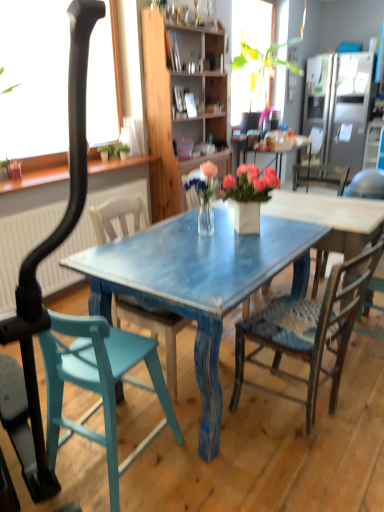
The image size is (384, 512). Describe the element at coordinates (306, 333) in the screenshot. I see `wooden chair with woven seat at center, which appears as the third chair when viewed from the left` at that location.

Measure the distance between wooden cabinet at center and camera.

wooden cabinet at center is 10.69 feet away from camera.

The image size is (384, 512). I want to click on satin silver refrigerator at upper right, so click(344, 110).

Is point (154, 196) less distant than point (370, 195)?

No, (154, 196) is behind (370, 195).

Is wooden cabinet at center far away from wooden chair at right, the 1th chair from the right?

Indeed, wooden cabinet at center is not near wooden chair at right, the 1th chair from the right.

From the image's perspective, does wooden cabinet at center appear lower than wooden chair at right, the 1th chair from the right?

Incorrect, from the image's perspective, wooden cabinet at center is higher than wooden chair at right, the 1th chair from the right.

Based on the photo, from a real-world perspective, which object stands above the other?

satin silver refrigerator at upper right.

Can you confirm if teal painted wood chair at lower left, positioned as the 4th chair in right-to-left order, is bigger than satin silver refrigerator at upper right?

No, teal painted wood chair at lower left, positioned as the 4th chair in right-to-left order, is not bigger than satin silver refrigerator at upper right.

Is teal painted wood chair at lower left, positioned as the 4th chair in right-to-left order, taller or shorter than satin silver refrigerator at upper right?

Considering their sizes, teal painted wood chair at lower left, positioned as the 4th chair in right-to-left order, has less height than satin silver refrigerator at upper right.

Between wooden chair at right, placed as the 4th chair when sorted from left to right, and satin silver refrigerator at upper right, which one is positioned behind?

Positioned behind is satin silver refrigerator at upper right.

Are wooden chair at right, placed as the 4th chair when sorted from left to right, and satin silver refrigerator at upper right located far from each other?

That's right, there is a large distance between wooden chair at right, placed as the 4th chair when sorted from left to right, and satin silver refrigerator at upper right.

Could you tell me if wooden chair at right, placed as the 4th chair when sorted from left to right, is turned towards satin silver refrigerator at upper right?

No, wooden chair at right, placed as the 4th chair when sorted from left to right, does not turn towards satin silver refrigerator at upper right.

Based on their sizes in the image, would you say wooden chair at right, the 1th chair from the right, is bigger or smaller than satin silver refrigerator at upper right?

Considering their sizes, wooden chair at right, the 1th chair from the right, takes up less space than satin silver refrigerator at upper right.

In the scene shown: Is wooden chair with woven seat at center, which appears as the third chair when viewed from the left, positioned with its back to wooden chair at right, the 1th chair from the right?

wooden chair with woven seat at center, which appears as the third chair when viewed from the left, does not have its back to wooden chair at right, the 1th chair from the right.

Based on the photo, between wooden chair with woven seat at center, which appears as the third chair when viewed from the left, and wooden chair at right, placed as the 4th chair when sorted from left to right, which one appears on the right side from the viewer's perspective?

From the viewer's perspective, wooden chair at right, placed as the 4th chair when sorted from left to right, appears more on the right side.

Is wooden chair with woven seat at center, arranged as the 2th chair when viewed from the right, next to wooden chair at right, placed as the 4th chair when sorted from left to right, and touching it?

No.

Is teal wood chair at center, which appears as the 3th chair when viewed from the right, positioned behind wooden chair with woven seat at center, arranged as the 2th chair when viewed from the right?

Yes, it is behind wooden chair with woven seat at center, arranged as the 2th chair when viewed from the right.

In the scene shown: Looking at the image, does teal wood chair at center, the 2th chair viewed from the left, seem bigger or smaller compared to wooden chair with woven seat at center, which appears as the third chair when viewed from the left?

Clearly, teal wood chair at center, the 2th chair viewed from the left, is larger in size than wooden chair with woven seat at center, which appears as the third chair when viewed from the left.

Is teal wood chair at center, the 2th chair viewed from the left, next to wooden chair with woven seat at center, which appears as the third chair when viewed from the left?

teal wood chair at center, the 2th chair viewed from the left, and wooden chair with woven seat at center, which appears as the third chair when viewed from the left, are not in contact.

Between teal wood chair at center, the 2th chair viewed from the left, and wooden chair with woven seat at center, which appears as the third chair when viewed from the left, which one has less height?

With less height is wooden chair with woven seat at center, which appears as the third chair when viewed from the left.

You are a GUI agent. You are given a task and a screenshot of the screen. Output one action in this format:
    pyautogui.click(x=<x>, y=<y>)
    Task: Click on the cabinetry behind the wooden chair at right, the 1th chair from the right
    The width and height of the screenshot is (384, 512).
    Given the screenshot: What is the action you would take?
    pyautogui.click(x=174, y=103)

From the image's perspective, which one is positioned higher, wooden chair at right, placed as the 4th chair when sorted from left to right, or wooden cabinet at center?

wooden cabinet at center, from the image's perspective.

Which object is further away from the camera, wooden chair at right, placed as the 4th chair when sorted from left to right, or wooden cabinet at center?

wooden cabinet at center.

Are teal painted wood chair at lower left, positioned as the 4th chair in right-to-left order, and teal wood chair at center, which appears as the 3th chair when viewed from the right, far apart?

No, there isn't a large distance between teal painted wood chair at lower left, positioned as the 4th chair in right-to-left order, and teal wood chair at center, which appears as the 3th chair when viewed from the right.

From the picture: From a real-world perspective, is teal painted wood chair at lower left, acting as the 1th chair starting from the left, under teal wood chair at center, the 2th chair viewed from the left?

Correct, in the physical world, teal painted wood chair at lower left, acting as the 1th chair starting from the left, is lower than teal wood chair at center, the 2th chair viewed from the left.

Which point is more distant from viewer, (115, 428) or (137, 198)?

The point (137, 198) is behind.

Is teal wood chair at center, the 2th chair viewed from the left, surrounded by teal painted wood chair at lower left, acting as the 1th chair starting from the left?

Definitely not — teal wood chair at center, the 2th chair viewed from the left, is not inside teal painted wood chair at lower left, acting as the 1th chair starting from the left.

In order to click on cabinetry above the wooden chair at right, the 1th chair from the right (from the image's perspective) in this screenshot , I will do `click(174, 103)`.

The height and width of the screenshot is (512, 384). I want to click on the 4th chair below when counting from the satin silver refrigerator at upper right (from the image's perspective), so click(x=99, y=384).

When comparing their distances from teal painted wood chair at lower left, positioned as the 4th chair in right-to-left order, does wooden chair with woven seat at center, arranged as the 2th chair when viewed from the right, or wooden chair at right, placed as the 4th chair when sorted from left to right, seem closer?

wooden chair with woven seat at center, arranged as the 2th chair when viewed from the right, is closer to teal painted wood chair at lower left, positioned as the 4th chair in right-to-left order.

Estimate the real-world distances between objects in this image. Which object is further from wooden chair with woven seat at center, which appears as the third chair when viewed from the left, wooden cabinet at center or wooden chair at right, placed as the 4th chair when sorted from left to right?

wooden cabinet at center.

When comparing their distances from wooden chair at right, the 1th chair from the right, does satin silver refrigerator at upper right or wooden chair with woven seat at center, arranged as the 2th chair when viewed from the right, seem closer?

The object closer to wooden chair at right, the 1th chair from the right, is wooden chair with woven seat at center, arranged as the 2th chair when viewed from the right.

When comparing their distances from wooden chair with woven seat at center, arranged as the 2th chair when viewed from the right, does teal wood chair at center, the 2th chair viewed from the left, or wooden cabinet at center seem further?

wooden cabinet at center lies further to wooden chair with woven seat at center, arranged as the 2th chair when viewed from the right, than the other object.

Estimate the real-world distances between objects in this image. Which object is further from wooden chair with woven seat at center, which appears as the third chair when viewed from the left, teal painted wood chair at lower left, acting as the 1th chair starting from the left, or satin silver refrigerator at upper right?

satin silver refrigerator at upper right is further to wooden chair with woven seat at center, which appears as the third chair when viewed from the left.

From the image, which object appears to be farther from teal painted wood chair at lower left, positioned as the 4th chair in right-to-left order, teal wood chair at center, which appears as the 3th chair when viewed from the right, or wooden cabinet at center?

wooden cabinet at center is positioned further to the anchor teal painted wood chair at lower left, positioned as the 4th chair in right-to-left order.

Estimate the real-world distances between objects in this image. Which object is further from wooden chair at right, placed as the 4th chair when sorted from left to right, wooden cabinet at center or wooden chair with woven seat at center, arranged as the 2th chair when viewed from the right?

wooden cabinet at center lies further to wooden chair at right, placed as the 4th chair when sorted from left to right, than the other object.

From the image, which object appears to be nearer to teal wood chair at center, the 2th chair viewed from the left, teal painted wood chair at lower left, positioned as the 4th chair in right-to-left order, or wooden cabinet at center?

Based on the image, teal painted wood chair at lower left, positioned as the 4th chair in right-to-left order, appears to be nearer to teal wood chair at center, the 2th chair viewed from the left.

Where is `chair between teal painted wood chair at lower left, acting as the 1th chair starting from the left, and wooden chair with woven seat at center, arranged as the 2th chair when viewed from the right, from left to right`? chair between teal painted wood chair at lower left, acting as the 1th chair starting from the left, and wooden chair with woven seat at center, arranged as the 2th chair when viewed from the right, from left to right is located at coordinates tap(153, 330).

Find the location of a particular element. The width and height of the screenshot is (384, 512). chair between teal wood chair at center, the 2th chair viewed from the left, and satin silver refrigerator at upper right from front to back is located at coordinates coord(340,248).

Where is `cabinetry positioned between wooden chair at right, placed as the 4th chair when sorted from left to right, and satin silver refrigerator at upper right from near to far`? The width and height of the screenshot is (384, 512). cabinetry positioned between wooden chair at right, placed as the 4th chair when sorted from left to right, and satin silver refrigerator at upper right from near to far is located at coordinates (174, 103).

Where is `cabinetry between teal wood chair at center, the 2th chair viewed from the left, and satin silver refrigerator at upper right in the front-back direction`? cabinetry between teal wood chair at center, the 2th chair viewed from the left, and satin silver refrigerator at upper right in the front-back direction is located at coordinates (174, 103).